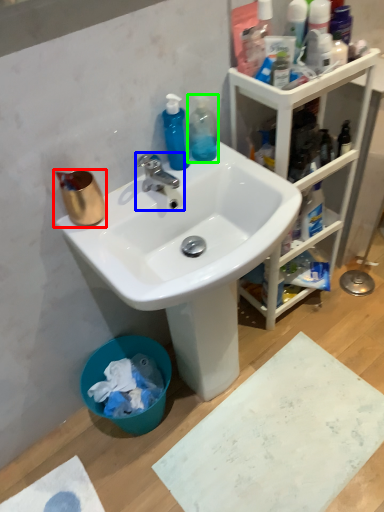
Question: Considering the real-world distances, which object is closest to coffee cup (highlighted by a red box)? tap (highlighted by a blue box) or cleaning product (highlighted by a green box).

Choices:
 (A) tap
 (B) cleaning product

Answer: (A)